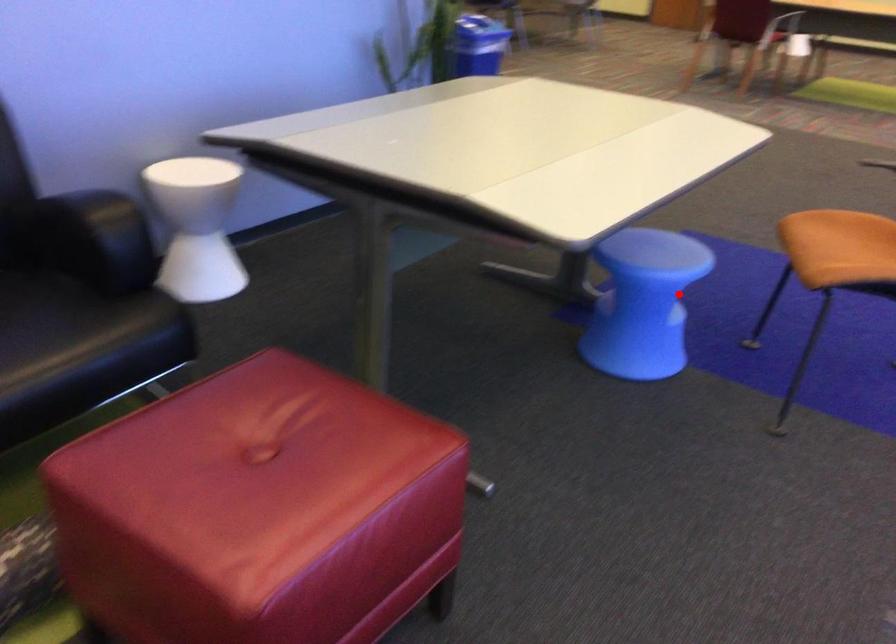
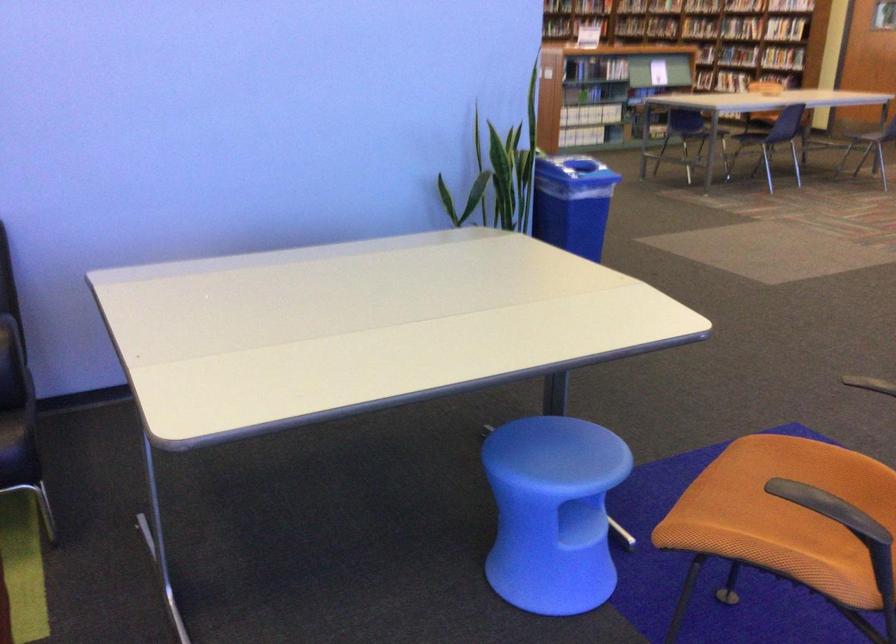
The point at the highlighted location is marked in the first image. Where is the corresponding point in the second image?

(553, 512)